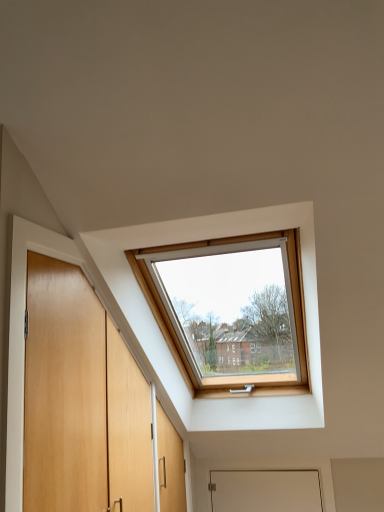
Describe the element at coordinates (265, 490) in the screenshot. I see `white matte door at lower center` at that location.

At what (x,y) coordinates should I click in order to perform the action: click on white matte door at lower center. Please return your answer as a coordinate pair (x, y). The width and height of the screenshot is (384, 512). Looking at the image, I should click on (265, 490).

Identify the location of white matte door at lower center. The image size is (384, 512). (265, 490).